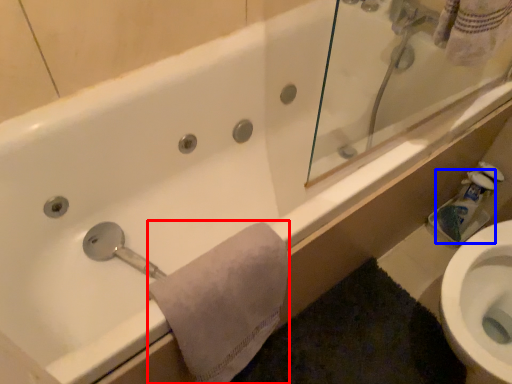
Question: Which object is closer to the camera taking this photo, bath towel (highlighted by a red box) or toilet paper (highlighted by a blue box)?

Choices:
 (A) bath towel
 (B) toilet paper

Answer: (A)